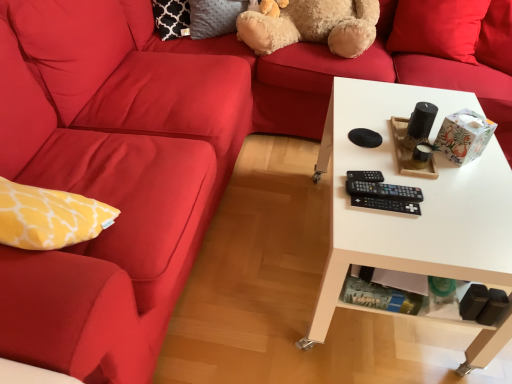
This screenshot has width=512, height=384. Find the location of `free space to the left of black plastic remote at center, which ranks as the 2th control in back-to-front order`. free space to the left of black plastic remote at center, which ranks as the 2th control in back-to-front order is located at coordinates (347, 191).